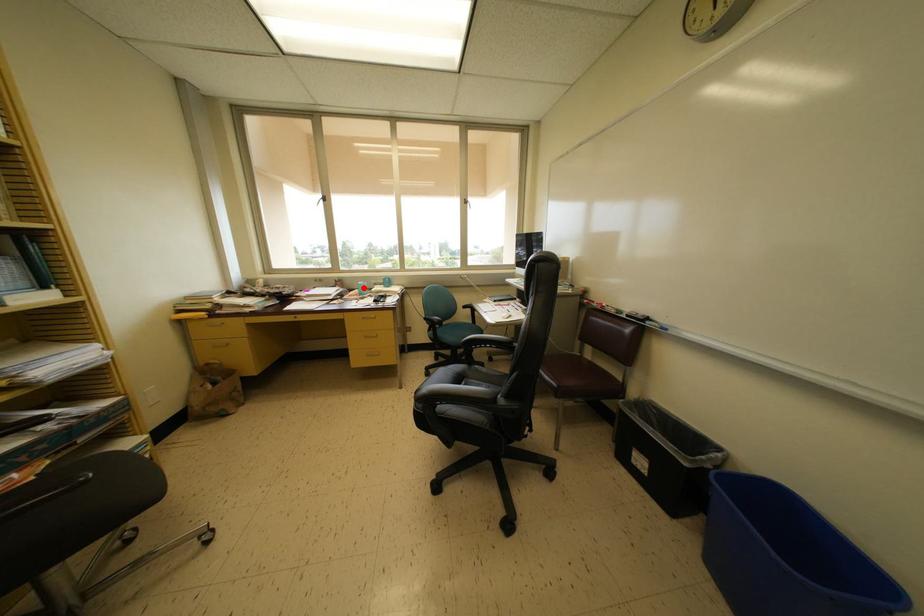
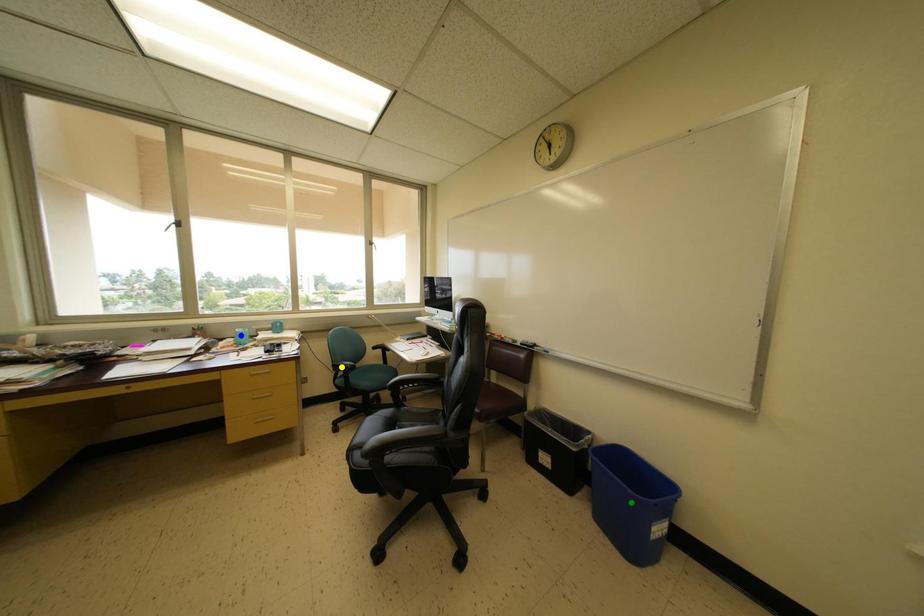
Question: I am providing you with two images of the same scene from different viewpoints. A red point is marked on the first image. You are given multiple points on the second image. Which spot in image 2 lines up with the point in image 1?

Choices:
 (A) green point
 (B) yellow point
 (C) blue point

Answer: (C)